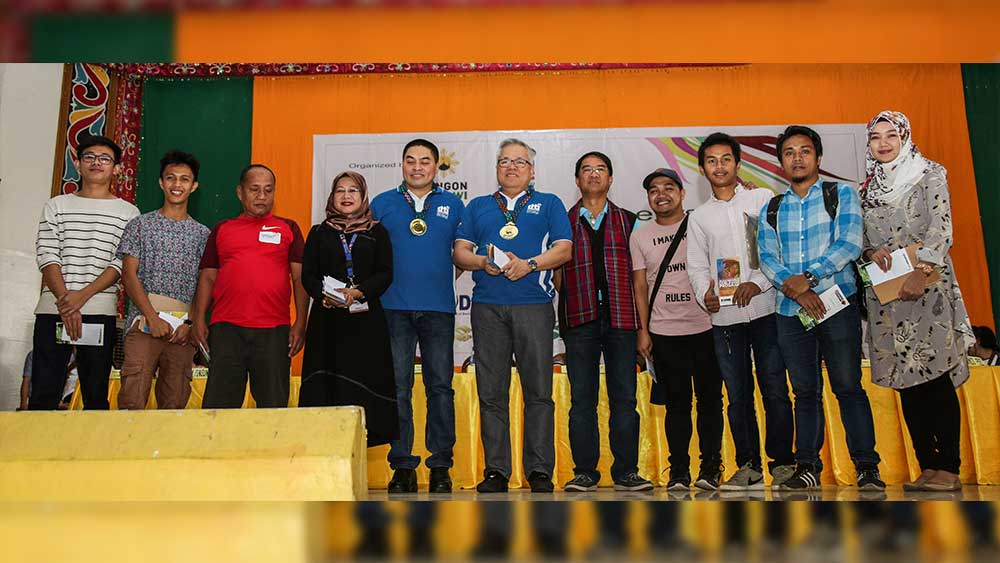
You are a GUI agent. You are given a task and a screenshot of the screen. Output one action in this format:
    pyautogui.click(x=<x>, y=<y>)
    Task: Click on the yellow table
    
    Given the screenshot: What is the action you would take?
    pyautogui.click(x=456, y=391)